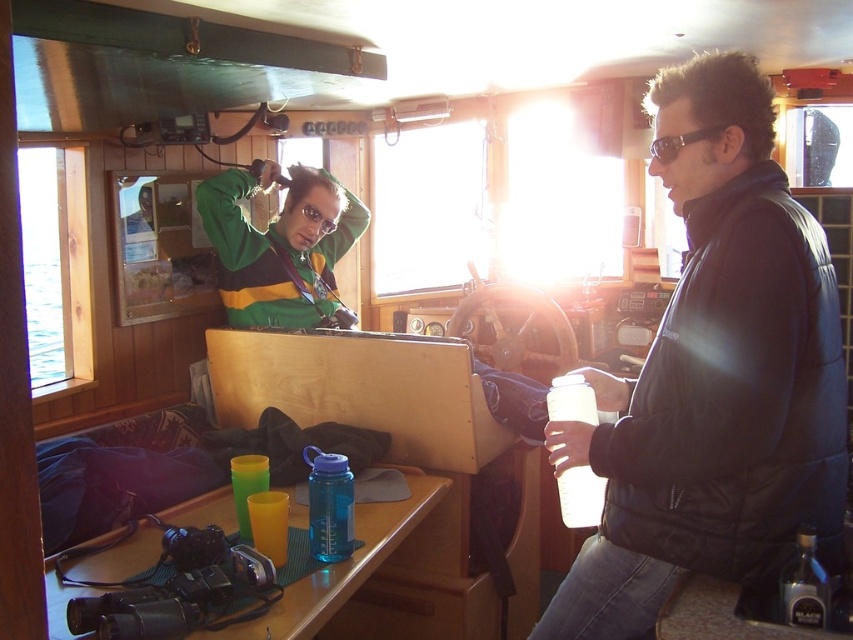
Can you confirm if blue plastic water bottle at lower left is shorter than matte plastic camera at lower right?

Incorrect, blue plastic water bottle at lower left's height does not fall short of matte plastic camera at lower right's.

At what (x,y) coordinates should I click in order to perform the action: click on blue plastic water bottle at lower left. Please return your answer as a coordinate pair (x, y). Looking at the image, I should click on (343, 564).

Which of these two, green matte jacket at upper left or blue plastic water bottle at lower left, stands taller?

Standing taller between the two is green matte jacket at upper left.

Describe the element at coordinates (281, 248) in the screenshot. I see `green matte jacket at upper left` at that location.

At what (x,y) coordinates should I click in order to perform the action: click on green matte jacket at upper left. Please return your answer as a coordinate pair (x, y). This screenshot has height=640, width=853. Looking at the image, I should click on (281, 248).

Describe the element at coordinates (714, 378) in the screenshot. This screenshot has height=640, width=853. I see `matte black jacket at center` at that location.

Does matte black jacket at center have a greater width compared to black plastic goggles at upper right?

Indeed, matte black jacket at center has a greater width compared to black plastic goggles at upper right.

Does point (751, 90) come in front of point (668, 163)?

Yes.

Locate an element on the screen. Image resolution: width=853 pixels, height=640 pixels. matte black jacket at center is located at coordinates (714, 378).